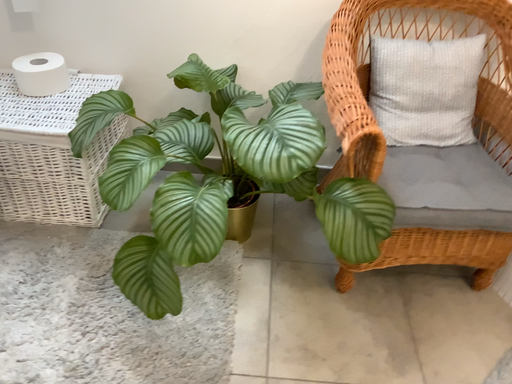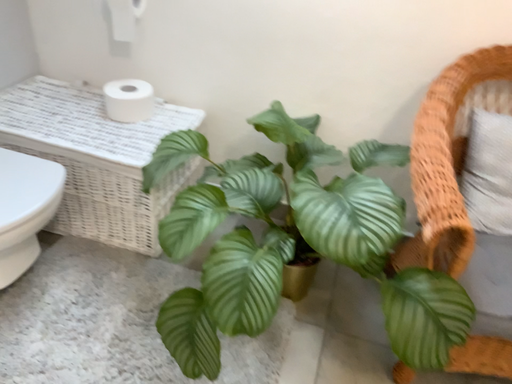
Question: How did the camera likely rotate when shooting the video?

Choices:
 (A) rotated right
 (B) rotated left

Answer: (B)